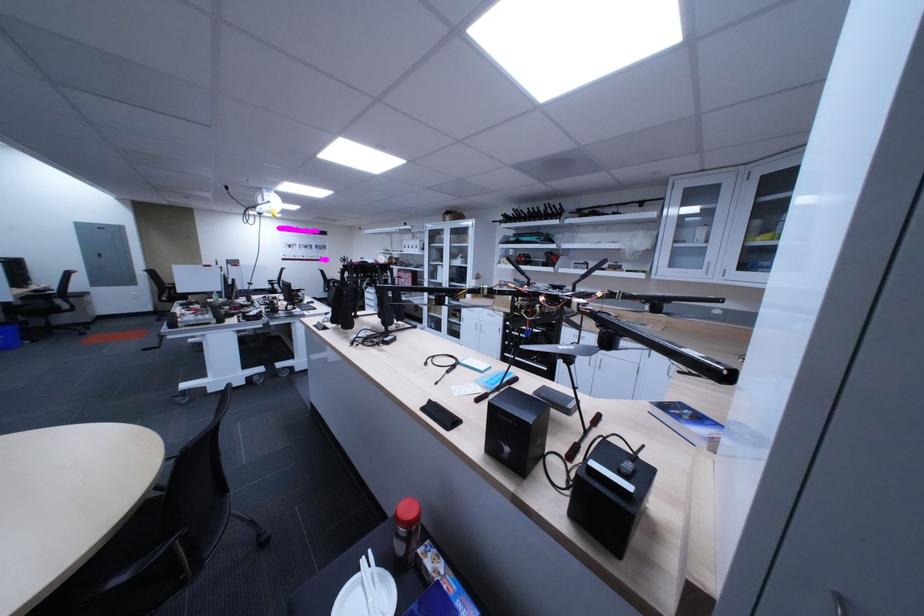
Find the location of a particular element. Image resolution: width=924 pixels, height=616 pixels. black chair armrest is located at coordinates (151, 567).